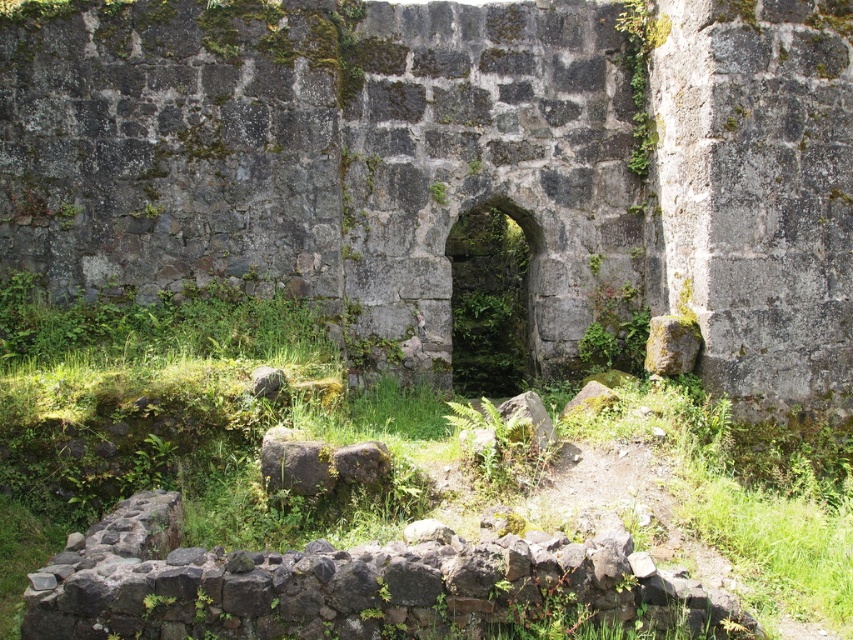
Question: Does gray stone arch at center have a larger size compared to green mossy stone archway at center?

Choices:
 (A) no
 (B) yes

Answer: (A)

Question: Is green grass at center to the left of gray rough stone at center from the viewer's perspective?

Choices:
 (A) no
 (B) yes

Answer: (A)

Question: Which point is closer to the camera?

Choices:
 (A) (294, 33)
 (B) (643, 400)

Answer: (B)

Question: Which point is farther from the camera taking this photo?

Choices:
 (A) (259, 394)
 (B) (212, 509)

Answer: (A)

Question: Is green grass at center thinner than gray rough stone at center?

Choices:
 (A) yes
 (B) no

Answer: (B)

Question: Which object is farther from the camera taking this photo?

Choices:
 (A) green mossy stone archway at center
 (B) gray rough stone at center
 (C) gray stone arch at center

Answer: (A)